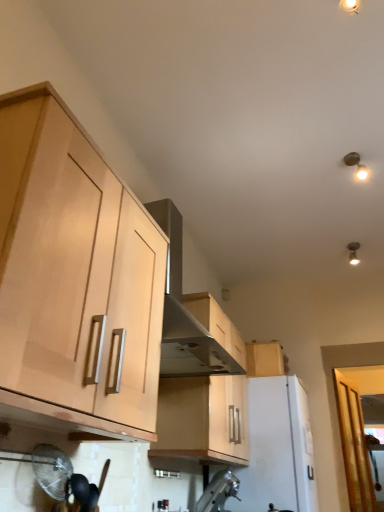
Question: Are light wood cabinet at left, positioned as the first cabinetry in left-to-right order, and stainless steel vent at upper center beside each other?

Choices:
 (A) yes
 (B) no

Answer: (B)

Question: Is the depth of light wood cabinet at left, placed as the 3th cabinetry when sorted from back to front, less than that of stainless steel vent at upper center?

Choices:
 (A) yes
 (B) no

Answer: (A)

Question: Is light wood cabinet at left, placed as the 3th cabinetry when sorted from back to front, bigger than stainless steel vent at upper center?

Choices:
 (A) no
 (B) yes

Answer: (A)

Question: Is light wood cabinet at left, the 1th cabinetry from the front, wider than stainless steel vent at upper center?

Choices:
 (A) no
 (B) yes

Answer: (A)

Question: Does light wood cabinet at left, the 3th cabinetry when ordered from right to left, contain stainless steel vent at upper center?

Choices:
 (A) yes
 (B) no

Answer: (B)

Question: Looking at their shapes, would you say wooden cabinet at center, marked as the 2th cabinetry in a front-to-back arrangement, is wider or thinner than transparent glass door at lower right?

Choices:
 (A) thin
 (B) wide

Answer: (B)

Question: Considering their positions, is wooden cabinet at center, marked as the 2th cabinetry in a front-to-back arrangement, located in front of or behind transparent glass door at lower right?

Choices:
 (A) behind
 (B) front

Answer: (B)

Question: Which is correct: wooden cabinet at center, the 2th cabinetry positioned from the right, is inside transparent glass door at lower right, or outside of it?

Choices:
 (A) inside
 (B) outside

Answer: (B)

Question: Is wooden cabinet at center, the 2th cabinetry positioned from the right, bigger or smaller than transparent glass door at lower right?

Choices:
 (A) small
 (B) big

Answer: (B)

Question: Does point (251, 504) appear closer or farther from the camera than point (223, 366)?

Choices:
 (A) farther
 (B) closer

Answer: (A)

Question: From the image's perspective, relative to stainless steel vent at upper center, is white matte refrigerator at center, which is the 2th appliance in front-to-back order, above or below?

Choices:
 (A) below
 (B) above

Answer: (A)

Question: Which is correct: white matte refrigerator at center, placed as the 1th appliance when sorted from back to front, is inside stainless steel vent at upper center, or outside of it?

Choices:
 (A) outside
 (B) inside

Answer: (A)

Question: In terms of width, does white matte refrigerator at center, placed as the 1th appliance when sorted from back to front, look wider or thinner when compared to stainless steel vent at upper center?

Choices:
 (A) wide
 (B) thin

Answer: (B)

Question: From the image's perspective, relative to transparent glass door at lower right, is white matte refrigerator at center, which is the 2th appliance in front-to-back order, above or below?

Choices:
 (A) below
 (B) above

Answer: (B)

Question: In the image, is white matte refrigerator at center, which is the 2th appliance in front-to-back order, positioned in front of or behind transparent glass door at lower right?

Choices:
 (A) behind
 (B) front

Answer: (B)